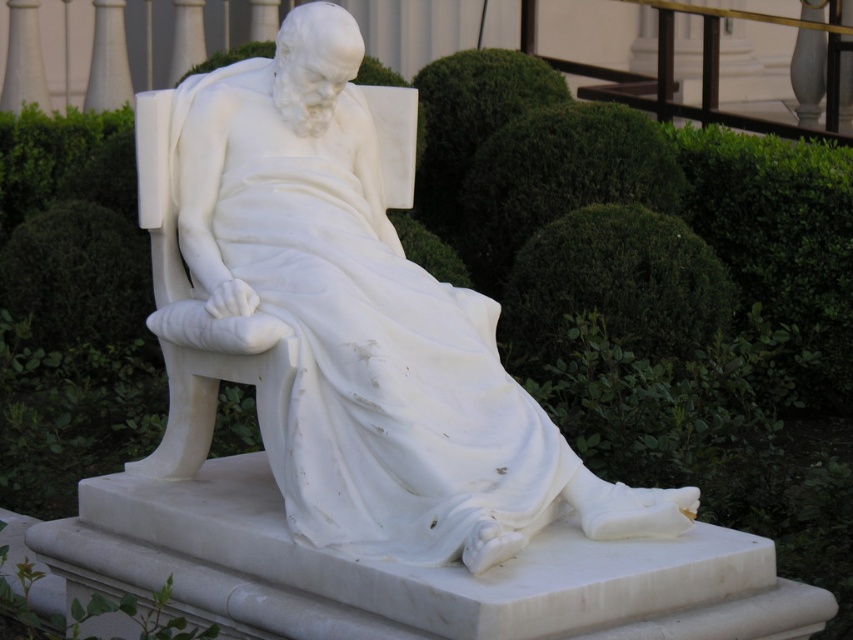
Which is in front, point (264, 60) or point (645, 355)?

Point (264, 60) is more forward.

Is white marble statue at center smaller than green leafy bush at center?

Yes.

Locate an element on the screen. white marble statue at center is located at coordinates (361, 323).